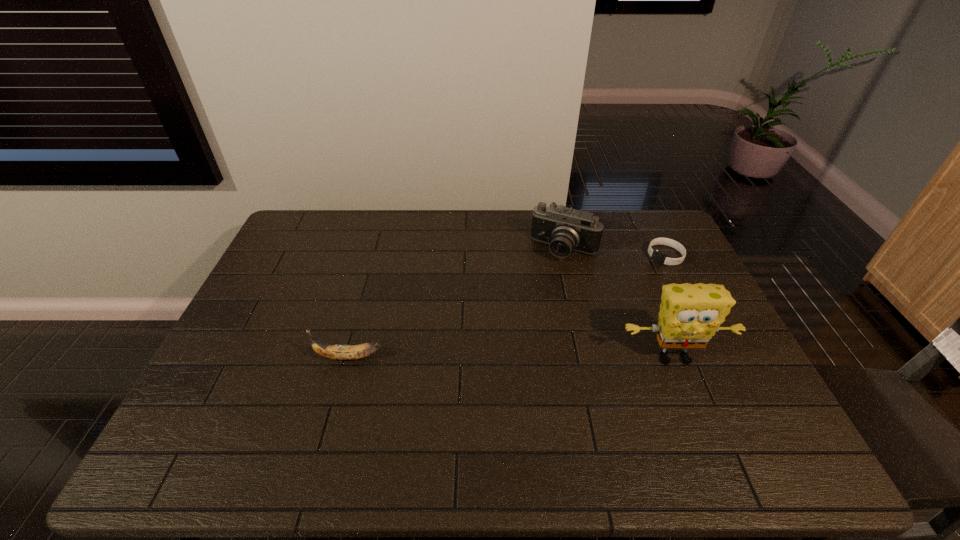
Image resolution: width=960 pixels, height=540 pixels. In order to click on the second shortest object in this screenshot , I will do `click(337, 352)`.

Image resolution: width=960 pixels, height=540 pixels. I want to click on banana, so click(337, 352).

Where is `sponge`? This screenshot has height=540, width=960. sponge is located at coordinates (690, 314).

Locate an element on the screen. camera is located at coordinates (565, 229).

Locate an element on the screen. The height and width of the screenshot is (540, 960). wristband is located at coordinates (660, 258).

You are a GUI agent. You are given a task and a screenshot of the screen. Output one action in this format:
    pyautogui.click(x=<x>, y=<y>)
    Task: Click on the vacant space located on the peel of the third tallest object
    
    Given the screenshot: What is the action you would take?
    (x=274, y=357)

This screenshot has width=960, height=540. I want to click on free space located on the peel of the third tallest object, so click(225, 357).

You are a GUI agent. You are given a task and a screenshot of the screen. Output one action in this format:
    pyautogui.click(x=<x>, y=<y>)
    Task: Click on the vacant space located on the peel of the third tallest object
    This screenshot has height=540, width=960.
    Given the screenshot: What is the action you would take?
    pyautogui.click(x=292, y=357)

I want to click on vacant space located on the front-facing side of the camera, so click(526, 322).

The image size is (960, 540). Identify the location of vacant space situated on the front-facing side of the camera. (513, 350).